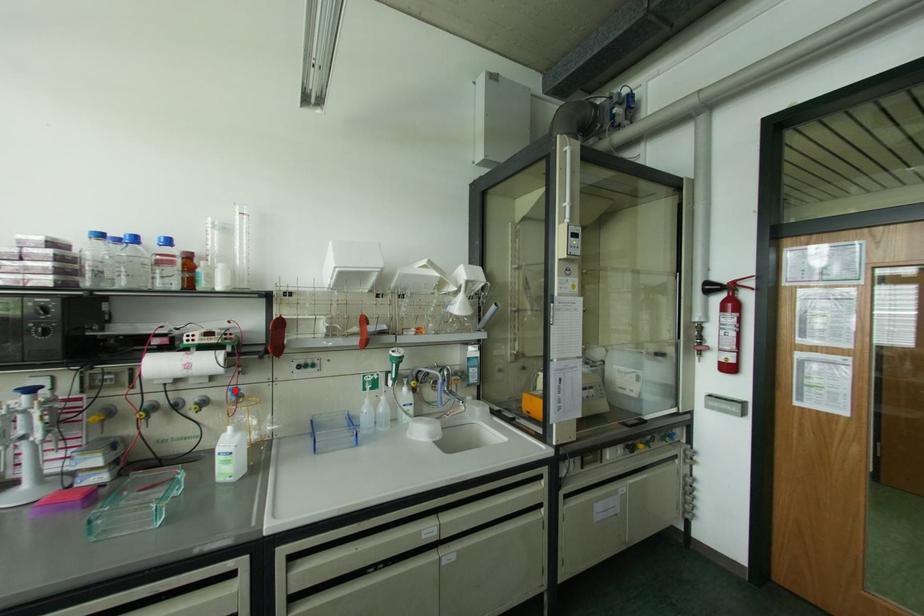
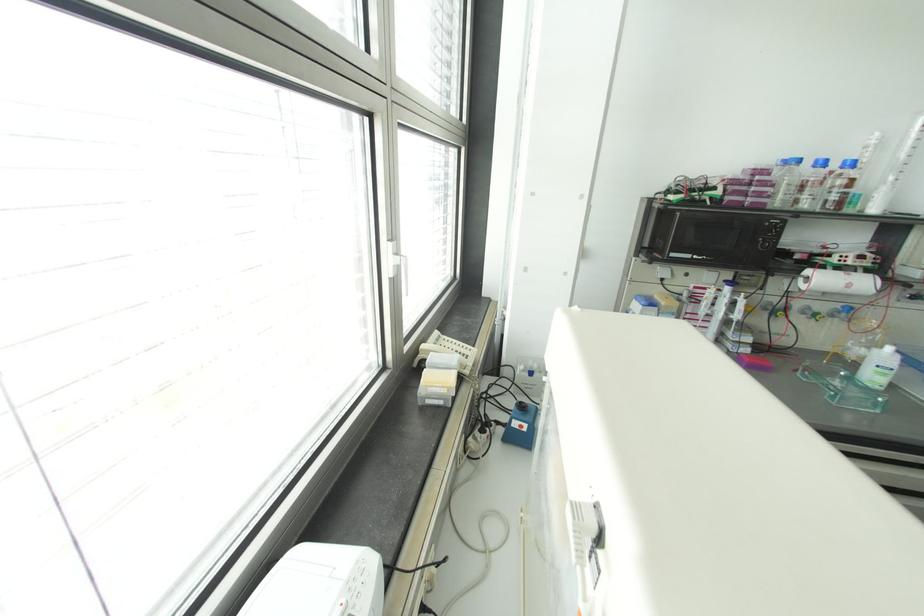
Find the pixel in the second image that matches the highlighted location in the first image.

(848, 309)